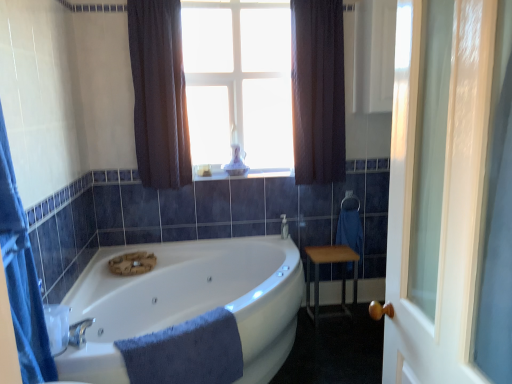
The image size is (512, 384). What do you see at coordinates (187, 352) in the screenshot? I see `blue soft towel at lower center` at bounding box center [187, 352].

Locate an element on the screen. This screenshot has height=384, width=512. blue soft towel at lower center is located at coordinates (187, 352).

I want to click on white glossy bathtub at center, so click(189, 302).

What do you see at coordinates (450, 194) in the screenshot? I see `clear glass door at right` at bounding box center [450, 194].

Find the location of a particular element. The height and width of the screenshot is (384, 512). transparent glass candle at upper center is located at coordinates (239, 81).

The height and width of the screenshot is (384, 512). What are the coordinates of `white glossy window sill at center` in the screenshot? It's located at (241, 173).

In order to face white glossy window sill at center, should I rotate leftwards or rightwards?

Turn left approximately 1.565 degrees to face it.

What is the approximate height of wooden table at right?

The height of wooden table at right is 50.73 centimeters.

Where is `blue soft towel at lower center`? Image resolution: width=512 pixels, height=384 pixels. blue soft towel at lower center is located at coordinates (187, 352).

Is wooden table at right not inside silver metallic towel bar at right?

Yes, wooden table at right is not within silver metallic towel bar at right.

Which of these two, wooden table at right or silver metallic towel bar at right, is thinner?

silver metallic towel bar at right.

From a real-world perspective, is wooden table at right positioned under silver metallic towel bar at right based on gravity?

Yes, from a real-world perspective, wooden table at right is under silver metallic towel bar at right.

How much distance is there between wooden table at right and silver metallic towel bar at right?

wooden table at right is 20.12 inches from silver metallic towel bar at right.

From the image's perspective, is dark fabric curtain at upper center, arranged as the 1th curtain when viewed from the left, above or below transparent glass candle at upper center?

Based on their image positions, dark fabric curtain at upper center, arranged as the 1th curtain when viewed from the left, is located beneath transparent glass candle at upper center.

Does dark fabric curtain at upper center, arranged as the 1th curtain when viewed from the left, turn towards transparent glass candle at upper center?

No, dark fabric curtain at upper center, arranged as the 1th curtain when viewed from the left, is not turned towards transparent glass candle at upper center.

Considering the sizes of objects dark fabric curtain at upper center, which is the second curtain in right-to-left order, and transparent glass candle at upper center in the image provided, who is taller, dark fabric curtain at upper center, which is the second curtain in right-to-left order, or transparent glass candle at upper center?

With more height is dark fabric curtain at upper center, which is the second curtain in right-to-left order.

In the scene shown: Is dark fabric curtain at upper center, which is the second curtain in right-to-left order, bigger or smaller than transparent glass candle at upper center?

In the image, dark fabric curtain at upper center, which is the second curtain in right-to-left order, appears to be larger than transparent glass candle at upper center.

Is transparent glass candle at upper center shorter than white glossy bathtub at center?

In fact, transparent glass candle at upper center may be taller than white glossy bathtub at center.

The height and width of the screenshot is (384, 512). Identify the location of bathtub in front of the transparent glass candle at upper center. (189, 302).

Is transparent glass candle at upper center facing towards white glossy bathtub at center?

No, transparent glass candle at upper center is not turned towards white glossy bathtub at center.

Which object is thinner, transparent glass candle at upper center or white glossy bathtub at center?

transparent glass candle at upper center.

From a real-world perspective, is white glossy window sill at center physically above dark textured curtain at upper center, the 1th curtain positioned from the right?

No.

Is white glossy window sill at center looking in the opposite direction of dark textured curtain at upper center, the 1th curtain positioned from the right?

That's not correct — white glossy window sill at center is not looking away from dark textured curtain at upper center, the 1th curtain positioned from the right.

Are white glossy window sill at center and dark textured curtain at upper center, the 1th curtain positioned from the right, beside each other?

No, white glossy window sill at center is not with dark textured curtain at upper center, the 1th curtain positioned from the right.

Who is more distant, white glossy window sill at center or dark textured curtain at upper center, the 1th curtain positioned from the right?

white glossy window sill at center is further from the camera.

Is clear glass door at right positioned far away from silver metallic towel bar at right?

Yes.

Is clear glass door at right positioned with its back to silver metallic towel bar at right?

That's not correct — clear glass door at right is not looking away from silver metallic towel bar at right.

Can you tell me how much clear glass door at right and silver metallic towel bar at right differ in facing direction?

The angle between the facing direction of clear glass door at right and the facing direction of silver metallic towel bar at right is 92.9 degrees.

Can you confirm if blue fabric shower curtain at left is taller than wooden table at right?

Yes, blue fabric shower curtain at left is taller than wooden table at right.

Who is smaller, blue fabric shower curtain at left or wooden table at right?

With smaller size is wooden table at right.

From the image's perspective, is blue fabric shower curtain at left over wooden table at right?

Yes, from the image's perspective, blue fabric shower curtain at left is over wooden table at right.

This screenshot has height=384, width=512. What are the coordinates of `shower curtain that is in front of the wooden table at right` in the screenshot? It's located at (22, 276).

Is white glossy window sill at center far from blue fabric shower curtain at left?

Yes, white glossy window sill at center and blue fabric shower curtain at left are located far from each other.

In order to click on window sill above the blue fabric shower curtain at left (from the image's perspective) in this screenshot , I will do `click(241, 173)`.

From the image's perspective, is white glossy window sill at center located beneath blue fabric shower curtain at left?

No.

What's the angular difference between white glossy window sill at center and blue fabric shower curtain at left's facing directions?

90.6 degrees separate the facing orientations of white glossy window sill at center and blue fabric shower curtain at left.

Locate an element on the screen. The width and height of the screenshot is (512, 384). table located underneath the silver metallic towel bar at right (from a real-world perspective) is located at coordinates (318, 276).

In the image, there is a dark fabric curtain at upper center, arranged as the 1th curtain when viewed from the left. Where is `bay window above it (from the image's perspective)`? Image resolution: width=512 pixels, height=384 pixels. bay window above it (from the image's perspective) is located at coordinates [239, 81].

When comparing their distances from transparent glass candle at upper center, does white glossy bathtub at center or dark textured curtain at upper center, acting as the 2th curtain starting from the left, seem closer?

The object closer to transparent glass candle at upper center is dark textured curtain at upper center, acting as the 2th curtain starting from the left.

Based on their spatial positions, is silver metallic towel bar at right or dark fabric curtain at upper center, arranged as the 1th curtain when viewed from the left, further from dark textured curtain at upper center, acting as the 2th curtain starting from the left?

dark fabric curtain at upper center, arranged as the 1th curtain when viewed from the left.

Which object lies nearer to the anchor point dark fabric curtain at upper center, which is the second curtain in right-to-left order, wooden table at right or clear glass door at right?

The object closer to dark fabric curtain at upper center, which is the second curtain in right-to-left order, is wooden table at right.

Based on their spatial positions, is wooden table at right or blue soft towel at lower center further from white glossy window sill at center?

Among the two, blue soft towel at lower center is located further to white glossy window sill at center.

When comparing their distances from blue soft towel at lower center, does white glossy window sill at center or dark textured curtain at upper center, the 1th curtain positioned from the right, seem closer?

white glossy window sill at center is closer to blue soft towel at lower center.

Based on their spatial positions, is wooden table at right or silver metallic towel bar at right closer to dark fabric curtain at upper center, which is the second curtain in right-to-left order?

wooden table at right lies closer to dark fabric curtain at upper center, which is the second curtain in right-to-left order, than the other object.

When comparing their distances from silver metallic towel bar at right, does dark textured curtain at upper center, the 1th curtain positioned from the right, or white glossy window sill at center seem closer?

Based on the image, white glossy window sill at center appears to be nearer to silver metallic towel bar at right.

Estimate the real-world distances between objects in this image. Which object is further from white glossy window sill at center, transparent glass candle at upper center or white glossy bathtub at center?

white glossy bathtub at center is positioned further to the anchor white glossy window sill at center.

Where is `window sill between dark textured curtain at upper center, acting as the 2th curtain starting from the left, and wooden table at right in the up-down direction`? This screenshot has width=512, height=384. window sill between dark textured curtain at upper center, acting as the 2th curtain starting from the left, and wooden table at right in the up-down direction is located at coordinates pos(241,173).

Locate an element on the screen. table positioned between blue soft towel at lower center and silver metallic towel bar at right from near to far is located at coordinates (318, 276).

Identify the location of bathtub between transparent glass candle at upper center and blue soft towel at lower center in the up-down direction. Image resolution: width=512 pixels, height=384 pixels. (189, 302).

Image resolution: width=512 pixels, height=384 pixels. Identify the location of shower curtain between clear glass door at right and dark textured curtain at upper center, the 1th curtain positioned from the right, from front to back. (22, 276).